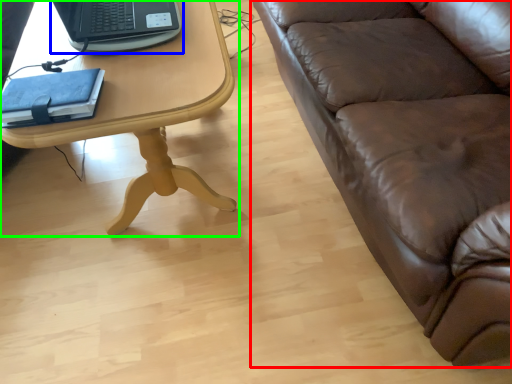
Question: Which object is positioned closest to studio couch (highlighted by a red box)? Select from laptop (highlighted by a blue box) and table (highlighted by a green box).

Choices:
 (A) laptop
 (B) table

Answer: (B)